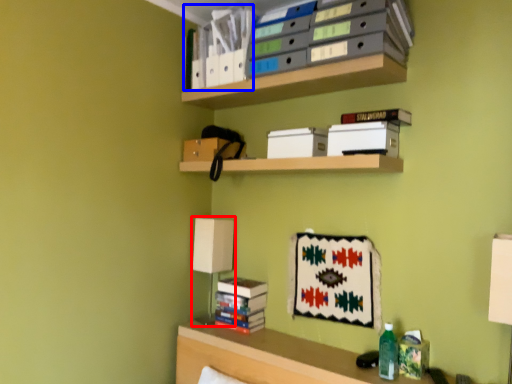
Question: Which of the following is the closest to the observer, table lamp (highlighted by a red box) or book (highlighted by a blue box)?

Choices:
 (A) table lamp
 (B) book

Answer: (B)